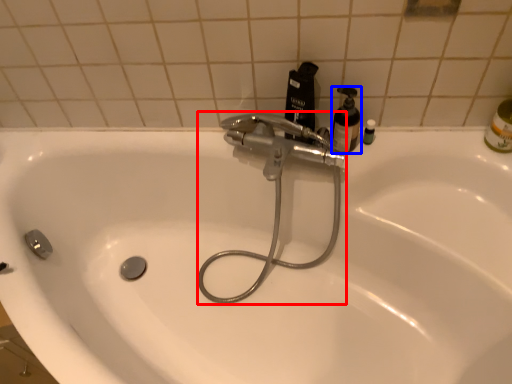
Question: Which object appears closest to the camera in this image, plumbing fixture (highlighted by a red box) or mouthwash (highlighted by a blue box)?

Choices:
 (A) plumbing fixture
 (B) mouthwash

Answer: (A)